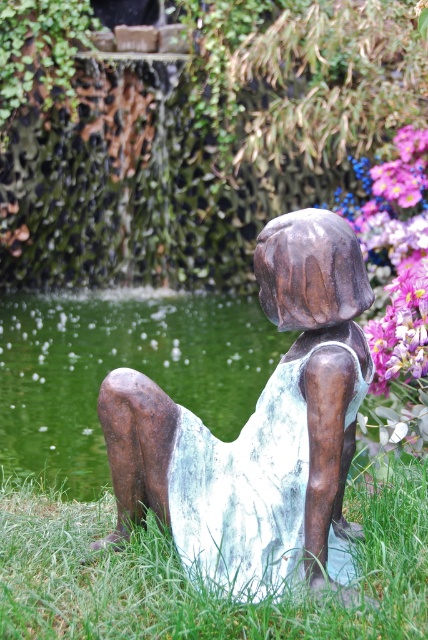
You are a gardener who wants to plant flowers in the garden shown. You have two spots to choose from near the bronze statue of a seated figure. One spot is on the green grass at lower center, and the other is near the green metallic water at lower left. Which location has a surface that is lower in height compared to the other?

The green grass at lower center is not as tall as the green metallic water at lower left, so the green grass at lower center has a lower height compared to the green metallic water at lower left.

You are a gardener who wants to place a new decorative pot that is 1.2 meters tall next to the bronze statue at center and the green grass at lower center. Based on their heights, can the pot be placed so it doesn

The bronze statue at center is taller than the green grass at lower center. Since the decorative pot is 1.2 meters tall, it would be taller than both the statue and the grass, so placing it next to them would make it stand out more in height.